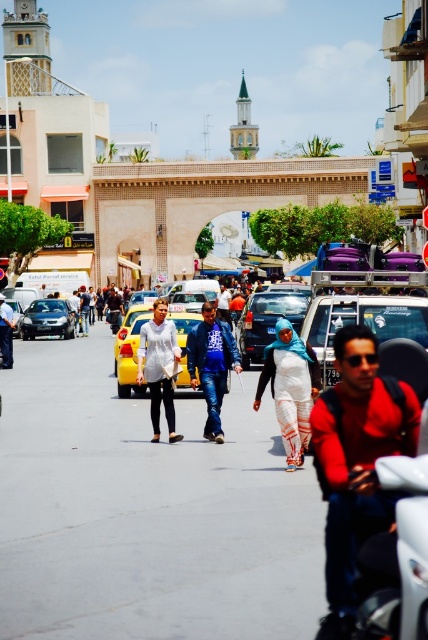
You are a pedestrian standing on the sidewalk observing the scene. You notice a red matte shirt at center and a yellow matte taxi at center. Which object is positioned lower in the image?

The red matte shirt at center is positioned below the yellow matte taxi at center, so it is lower in the image.